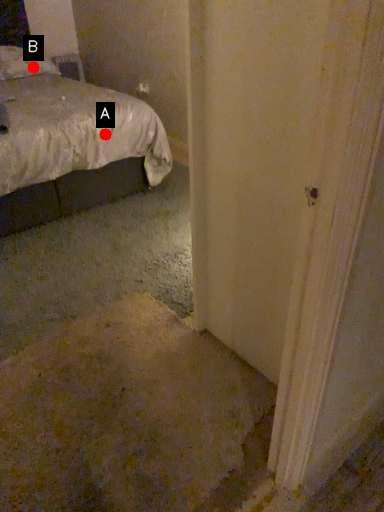
Question: Two points are circled on the image, labeled by A and B beside each circle. Which point is closer to the camera?

Choices:
 (A) A is closer
 (B) B is closer

Answer: (A)